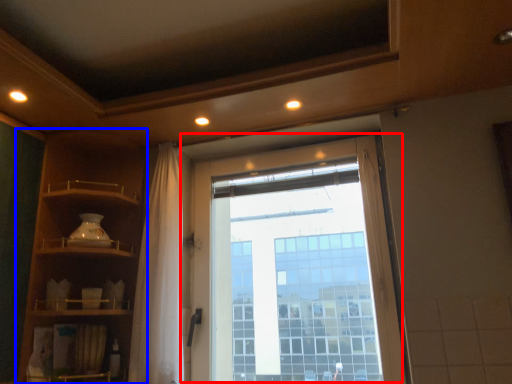
Question: Which object is closer to the camera taking this photo, window (highlighted by a red box) or shelf (highlighted by a blue box)?

Choices:
 (A) window
 (B) shelf

Answer: (B)